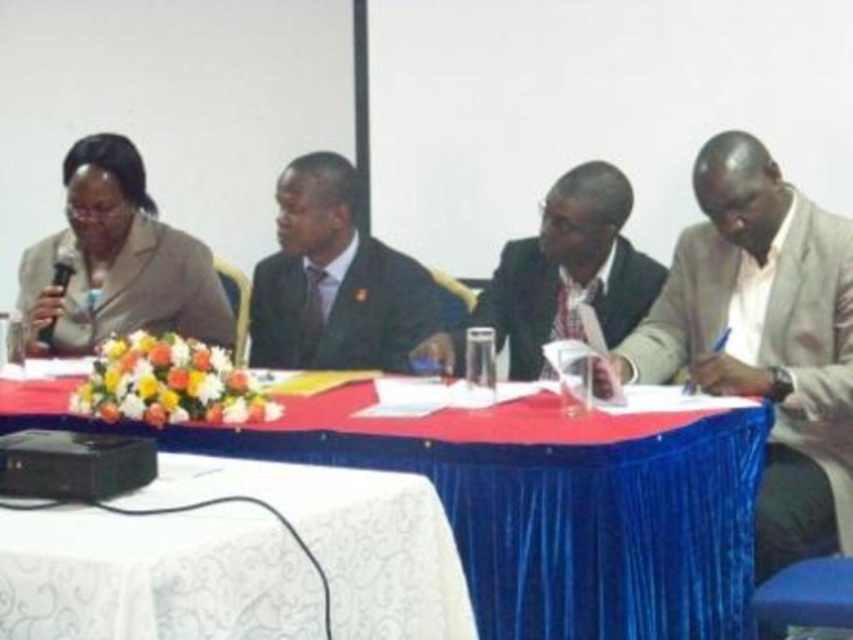
You are organizing a charity event and need to seat two guests with different body types. The light beige suit at right and the satin black suit at center are present. Which guest should you seat in a chair designed for a thinner frame?

The light beige suit at right is thinner than the satin black suit at center, so the guest wearing the light beige suit at right should be seated in the chair designed for a thinner frame.

You are a photographer setting up for a panel discussion. You need to place a microphone stand at a position that is 0.2 units to the right and 0.1 units above the white lace tablecloth at lower left. What are the coordinates of the microphone stand?

The coordinates of the microphone stand would be calculated by adding 0.2 to the x and 0.1 to the y of the white lace tablecloth at lower left. The original position is at point (155, 576). Adding 0.2 to x gives 1.100, but since coordinates can not exceed 1.0, it is capped at 1.0. Adding 0.1 to y gives 0.283. Therefore, the microphone stand should be placed at coordinates (241, 639).

You are standing at the point labeled point at (376, 266). You need to walk to the nearest exit, which is 3 meters away. Can you reach the exit without taking more than 3 steps?

The exit is exactly 3 meters away from the point at (376, 266), so you can reach it in 3 steps if each step is 1 meter long.